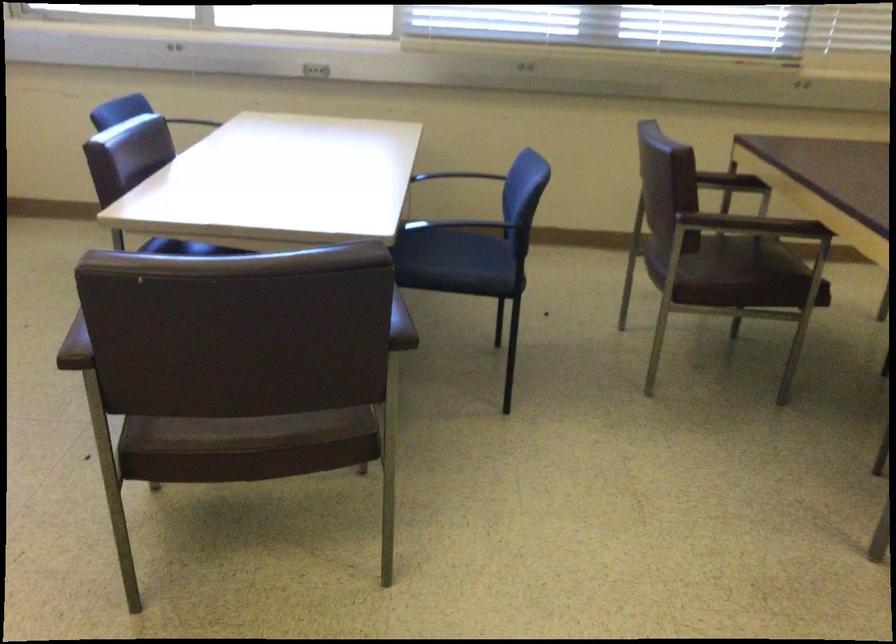
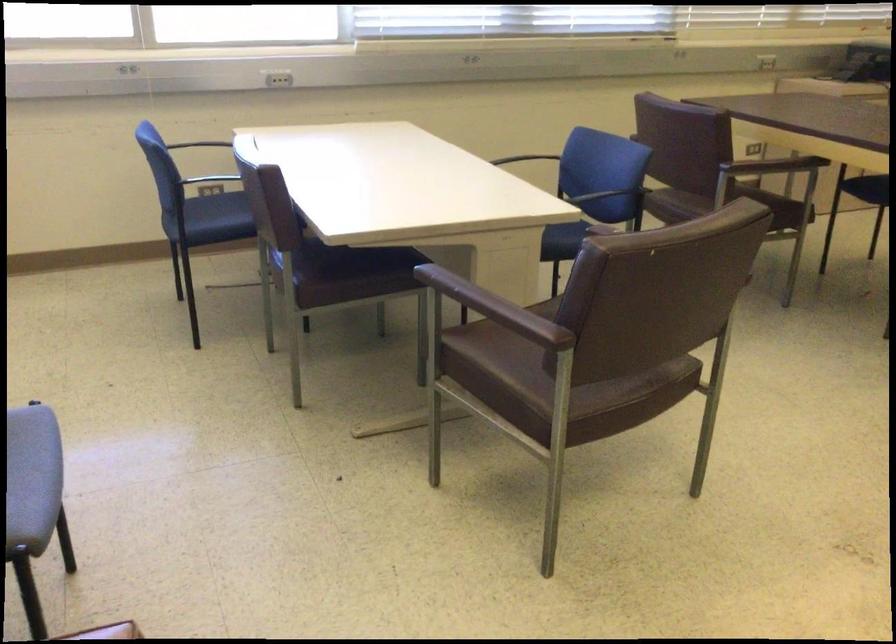
Question: I am providing you with two images of the same scene from different viewpoints. After the viewpoint changes to image2, which objects are now occluded?

Choices:
 (A) blue chair sitting surface
 (B) black chair armrest
 (C) metal chair armrest
 (D) blue bowl

Answer: (C)